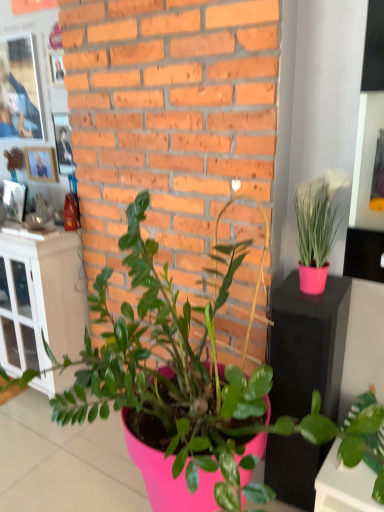
Question: Can you confirm if wooden photo frame at upper left is wider than pink matte plant at center, the 2th houseplant viewed from the right?

Choices:
 (A) no
 (B) yes

Answer: (A)

Question: Considering the relative sizes of wooden photo frame at upper left and pink matte plant at center, acting as the first houseplant starting from the left, in the image provided, is wooden photo frame at upper left smaller than pink matte plant at center, acting as the first houseplant starting from the left,?

Choices:
 (A) no
 (B) yes

Answer: (B)

Question: Can you confirm if wooden photo frame at upper left is positioned to the left of pink matte plant at center, acting as the first houseplant starting from the left?

Choices:
 (A) yes
 (B) no

Answer: (A)

Question: Does wooden photo frame at upper left have a greater height compared to pink matte plant at center, acting as the first houseplant starting from the left?

Choices:
 (A) yes
 (B) no

Answer: (B)

Question: From the image's perspective, is wooden photo frame at upper left above pink matte plant at center, the 2th houseplant viewed from the right?

Choices:
 (A) no
 (B) yes

Answer: (B)

Question: Is pink matte plant at center, acting as the first houseplant starting from the left, inside wooden photo frame at upper left?

Choices:
 (A) yes
 (B) no

Answer: (B)

Question: Is pink matte plant at center, the 2th houseplant viewed from the right, oriented away from wooden photo frame at upper left?

Choices:
 (A) yes
 (B) no

Answer: (B)

Question: Can you confirm if pink matte plant at center, the 2th houseplant viewed from the right, is wider than wooden photo frame at upper left?

Choices:
 (A) yes
 (B) no

Answer: (A)

Question: Is pink matte plant at center, the 2th houseplant viewed from the right, further to the viewer compared to wooden photo frame at upper left?

Choices:
 (A) yes
 (B) no

Answer: (B)

Question: Does pink matte plant at center, the 2th houseplant viewed from the right, have a greater height compared to wooden photo frame at upper left?

Choices:
 (A) yes
 (B) no

Answer: (A)

Question: Considering the relative positions of pink matte plant at center, the 2th houseplant viewed from the right, and wooden photo frame at upper left in the image provided, is pink matte plant at center, the 2th houseplant viewed from the right, to the left of wooden photo frame at upper left from the viewer's perspective?

Choices:
 (A) yes
 (B) no

Answer: (B)

Question: Would you say pink matte plant at center, the 2th houseplant viewed from the right, is outside wooden photo frame at upper left?

Choices:
 (A) no
 (B) yes

Answer: (B)

Question: Is white glass cabinet at left shorter than pink matte plant at center, the 2th houseplant viewed from the right?

Choices:
 (A) no
 (B) yes

Answer: (B)